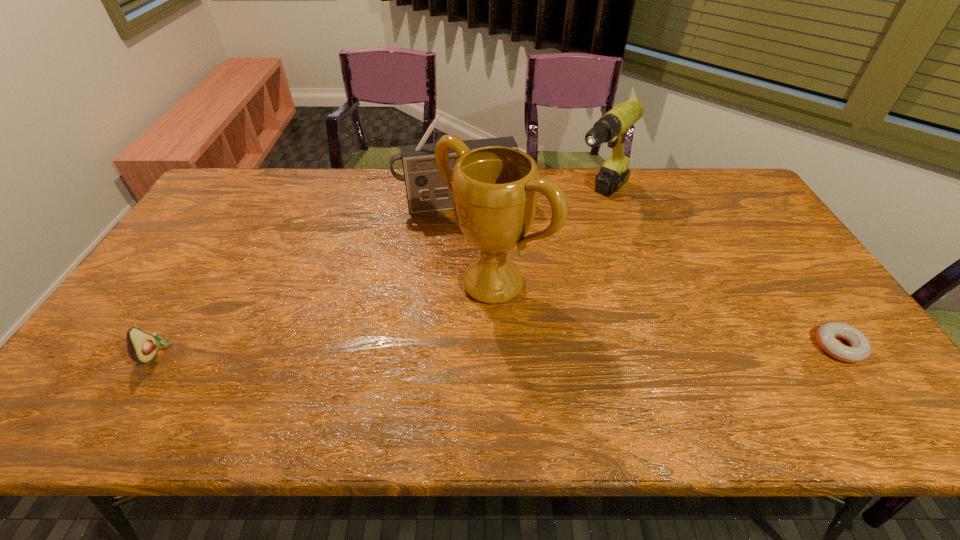
Locate an element on the screen. The height and width of the screenshot is (540, 960). the second shortest object is located at coordinates (141, 346).

At what (x,y) coordinates should I click in order to perform the action: click on the leftmost object. Please return your answer as a coordinate pair (x, y). The height and width of the screenshot is (540, 960). Looking at the image, I should click on [x=141, y=346].

This screenshot has height=540, width=960. Identify the location of the shortest object. (860, 350).

This screenshot has height=540, width=960. I want to click on the rightmost object, so click(860, 350).

Locate an element on the screen. radio receiver is located at coordinates (426, 191).

The width and height of the screenshot is (960, 540). I want to click on award, so click(x=495, y=189).

The image size is (960, 540). In order to click on the tallest object in this screenshot , I will do `click(495, 189)`.

Identify the location of the second object from right to left. (612, 127).

This screenshot has height=540, width=960. Find the location of `free space located on the seed side of the second shortest object`. free space located on the seed side of the second shortest object is located at coordinates coord(255,352).

This screenshot has height=540, width=960. Find the location of `vacant point located on the back of the rightmost object`. vacant point located on the back of the rightmost object is located at coordinates (813, 310).